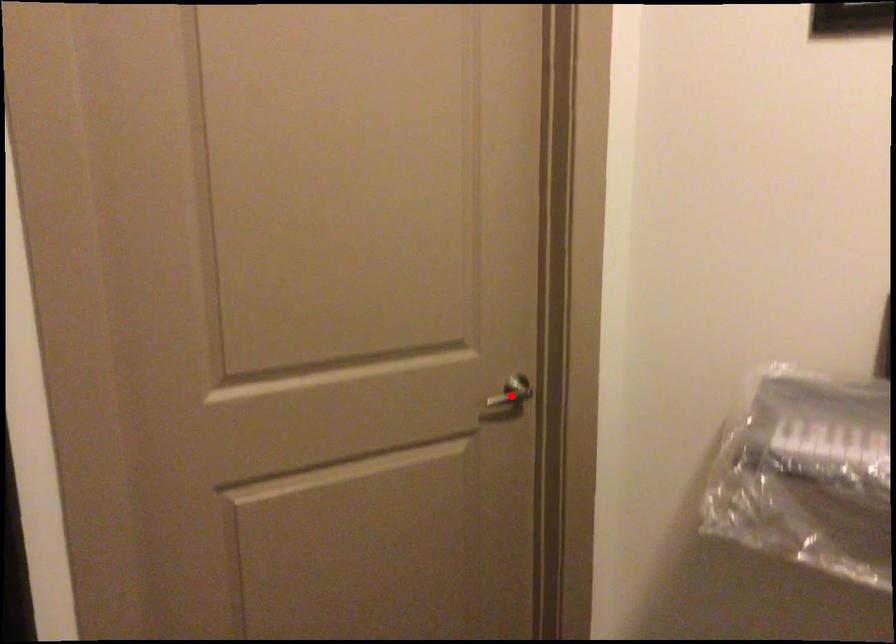
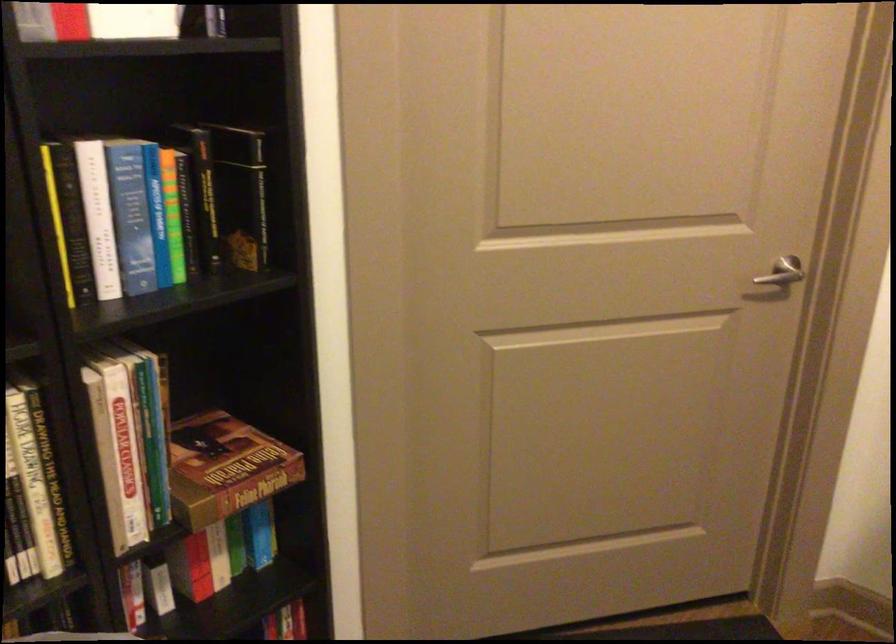
Find the pixel in the second image that matches the highlighted location in the first image.

(781, 272)